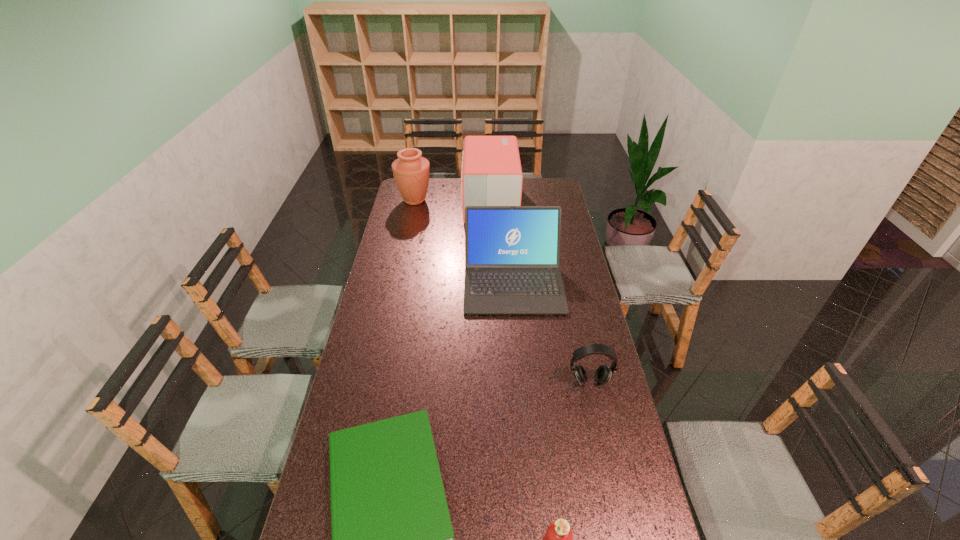
At what (x,y) coordinates should I click in order to perform the action: click on box. Please return your answer as a coordinate pair (x, y). The height and width of the screenshot is (540, 960). Looking at the image, I should click on (491, 175).

Identify the location of vase. This screenshot has width=960, height=540. (411, 171).

The height and width of the screenshot is (540, 960). What are the coordinates of `the fourth nearest object` in the screenshot? It's located at (512, 253).

Identify the location of earphone. (603, 373).

Where is `the second shortest object`? the second shortest object is located at coordinates (603, 373).

Find the location of a particular element. vacant space located on the surface of the box where the text is embossed is located at coordinates (417, 202).

Find the location of a particular element. The width and height of the screenshot is (960, 540). free space located 0.160m on the surface of the box where the text is embossed is located at coordinates (434, 202).

At what (x,y) coordinates should I click in order to perform the action: click on free space located on the surface of the box where the text is embossed. Please return your answer as a coordinate pair (x, y). This screenshot has width=960, height=540. Looking at the image, I should click on (416, 202).

I want to click on vacant space located 0.210m on the front of the vase, so click(408, 233).

Find the location of a particular element. free space located on the screen of the laptop computer is located at coordinates (517, 331).